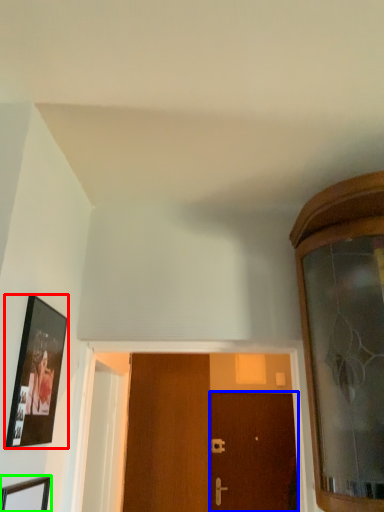
Question: Which object is positioned closest to picture frame (highlighted by a red box)? Select from door (highlighted by a blue box) and picture frame (highlighted by a green box).

Choices:
 (A) door
 (B) picture frame

Answer: (B)